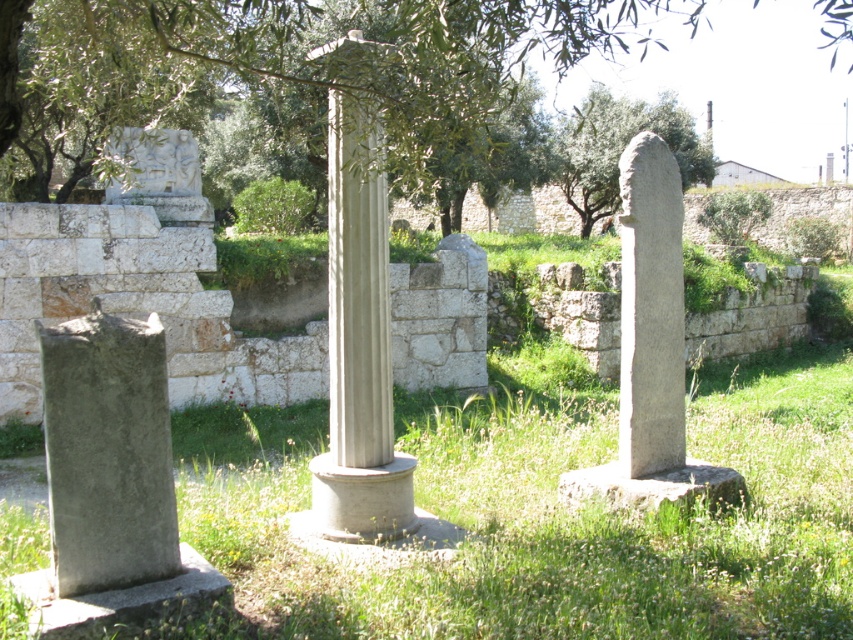
Is point (234, 54) positioned before point (334, 104)?

Yes, point (234, 54) is closer to viewer.

Describe the element at coordinates (532, 28) in the screenshot. I see `green leafy tree at upper center` at that location.

You are a GUI agent. You are given a task and a screenshot of the screen. Output one action in this format:
    pyautogui.click(x=<x>, y=<y>)
    Task: Click on the green leafy tree at upper center
    
    Given the screenshot: What is the action you would take?
    pyautogui.click(x=532, y=28)

Can you confirm if smooth stone column at center is wider than gray stone pillar at right?

Yes, smooth stone column at center is wider than gray stone pillar at right.

Does smooth stone column at center have a smaller size compared to gray stone pillar at right?

Actually, smooth stone column at center might be larger than gray stone pillar at right.

Does point (387, 516) come farther from viewer compared to point (630, 140)?

No.

Locate an element on the screen. smooth stone column at center is located at coordinates (358, 348).

Is green leafy tree at upper center positioned before gray stone pillar at right?

That is True.

Does point (448, 60) come farther from viewer compared to point (669, 365)?

No.

Which is behind, point (543, 49) or point (643, 272)?

The point (543, 49) is more distant.

Where is `green leafy tree at upper center`? The image size is (853, 640). green leafy tree at upper center is located at coordinates (532, 28).